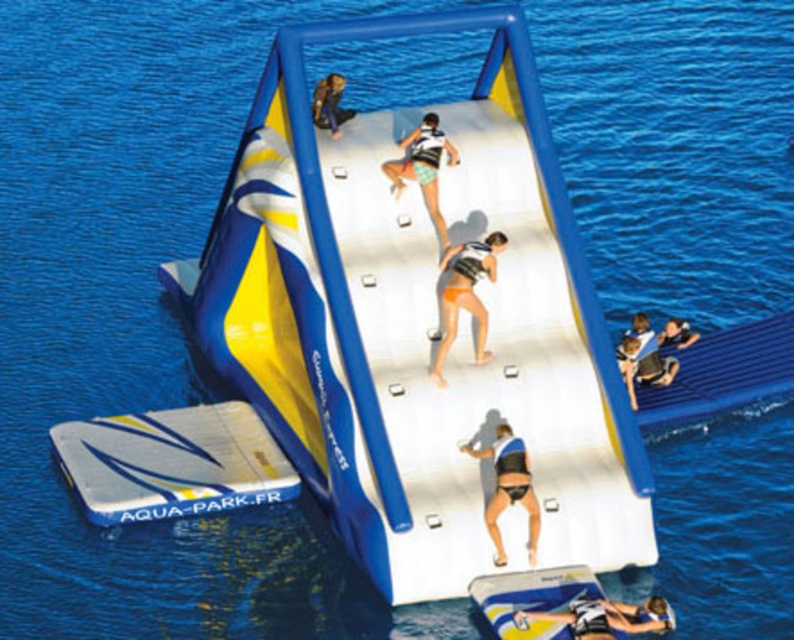
Is leather jacket at upper center taller than matte black life vest at lower right?

Correct, leather jacket at upper center is much taller as matte black life vest at lower right.

Between leather jacket at upper center and matte black life vest at lower right, which one is positioned lower?

matte black life vest at lower right

Which is behind, point (326, 120) or point (669, 330)?

Point (669, 330)

The width and height of the screenshot is (794, 640). What are the coordinates of `leather jacket at upper center` in the screenshot? It's located at (330, 104).

In the scene shown: How much distance is there between white matte surfboard at lower right and white matte shorts at center?

white matte surfboard at lower right and white matte shorts at center are 7.82 meters apart.

Between white matte surfboard at lower right and white matte shorts at center, which one is positioned lower?

white matte surfboard at lower right

The width and height of the screenshot is (794, 640). I want to click on white matte surfboard at lower right, so coord(604,618).

Can you confirm if black matte bikini at center is positioned to the left of matte black life vest at lower right?

Correct, you'll find black matte bikini at center to the left of matte black life vest at lower right.

Can you confirm if black matte bikini at center is positioned to the right of matte black life vest at lower right?

No, black matte bikini at center is not to the right of matte black life vest at lower right.

Is point (465, 451) positioned after point (685, 332)?

No, (465, 451) is closer to viewer.

The image size is (794, 640). What are the coordinates of `black matte bikini at center` in the screenshot? It's located at (507, 486).